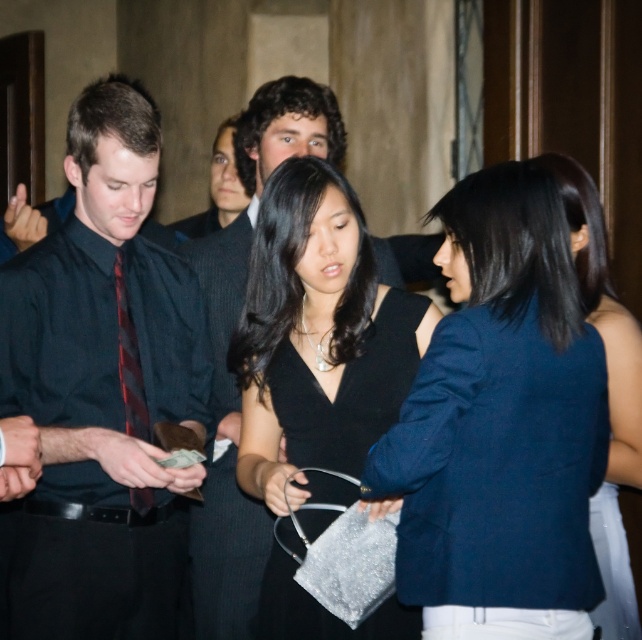
Question: Can you confirm if dark blue shirt at center is positioned to the left of black satin dress at center?

Choices:
 (A) no
 (B) yes

Answer: (B)

Question: Based on their relative distances, which object is farther from the dark blue shirt at center?

Choices:
 (A) black silk tie at left
 (B) matte black suit at center

Answer: (B)

Question: Which object appears farthest from the camera in this image?

Choices:
 (A) matte blue blazer at right
 (B) dark blue shirt at center
 (C) matte black suit at center
 (D) shiny black dress at center

Answer: (D)

Question: Is dark blue fabric jacket at center behind black silk tie at left?

Choices:
 (A) no
 (B) yes

Answer: (A)

Question: Which of the following is the closest to the observer?

Choices:
 (A) black satin dress at center
 (B) black silk tie at left
 (C) shiny black dress at center

Answer: (A)

Question: Does black satin dress at center have a larger size compared to shiny black dress at center?

Choices:
 (A) no
 (B) yes

Answer: (A)